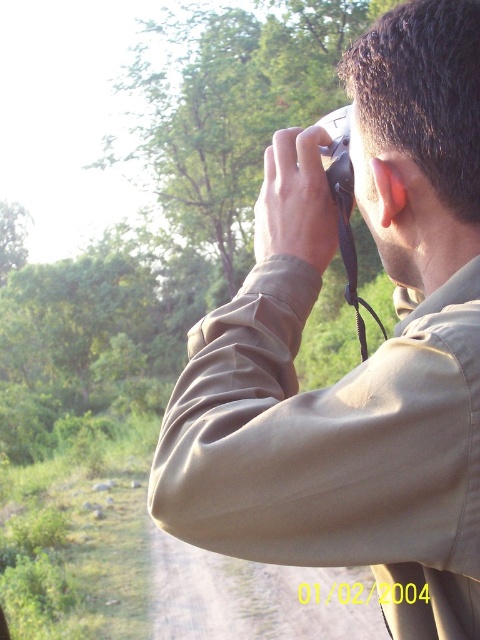
Consider the image. Which is more to the left, matte khaki shirt at center or black plastic camera at upper center?

black plastic camera at upper center

Is point (268, 532) positioned in front of point (345, 192)?

That is True.

Locate an element on the screen. The width and height of the screenshot is (480, 640). matte khaki shirt at center is located at coordinates (367, 358).